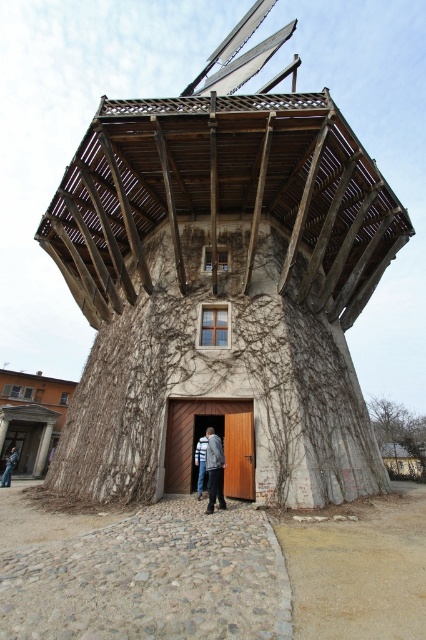
Question: Is gray fabric jacket at center to the left of denim jacket at lower left from the viewer's perspective?

Choices:
 (A) no
 (B) yes

Answer: (A)

Question: Which object is positioned farthest from the wooden windmill at center?

Choices:
 (A) green leafy tree at upper right
 (B) white stone building at lower left
 (C) gray fabric jacket at center
 (D) light blue denim jacket at center

Answer: (A)

Question: Among these objects, which one is nearest to the camera?

Choices:
 (A) light blue denim jacket at center
 (B) denim jacket at lower left
 (C) green leafy tree at upper right

Answer: (A)

Question: Does gray fabric jacket at center appear under denim jacket at lower left?

Choices:
 (A) yes
 (B) no

Answer: (B)

Question: Can you confirm if green leafy tree at upper right is wider than light blue denim jacket at center?

Choices:
 (A) no
 (B) yes

Answer: (B)

Question: Which object is closer to the camera taking this photo?

Choices:
 (A) light blue denim jacket at center
 (B) white stone building at lower left

Answer: (A)